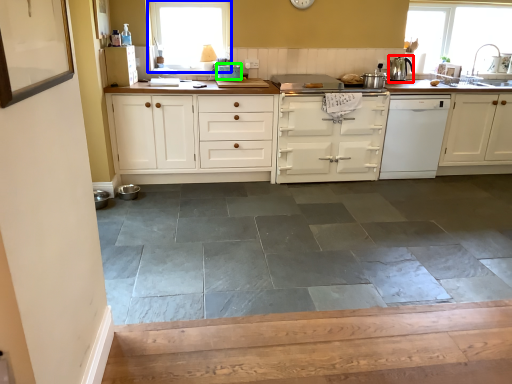
Question: Which object is the closest to the kitchen appliance (highlighted by a red box)? Choose among these: window (highlighted by a blue box) or appliance (highlighted by a green box).

Choices:
 (A) window
 (B) appliance

Answer: (B)